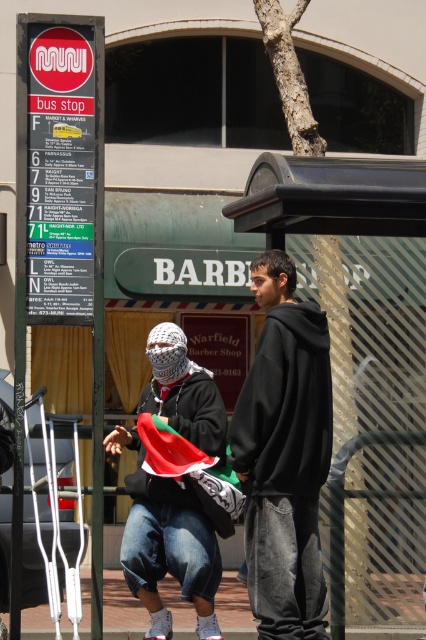
You are a visually impaired person using a white cane. You want to approach the bus stop sign on the left to check the schedule. There is a matte black hoodie at center and metallic silver crutches at lower left in your path. Which object is closer to you that you might need to navigate around?

The metallic silver crutches at lower left are behind the matte black hoodie at center, so the matte black hoodie at center is closer to you and you should navigate around it first.

You are at the bus stop and need to reach the person at point (199, 419). Is the person at point (354, 445) blocking your path?

Point (354, 445) is behind point (199, 419), so the person at point (354, 445) is not blocking your path to the person at point (199, 419).

You are at the bus stop and need to move your bag from the metallic silver crutches at lower left to the matte black hoodie at center. Which direction should you move the bag?

You should move the bag to the right, as the matte black hoodie at center is to the right of the metallic silver crutches at lower left.